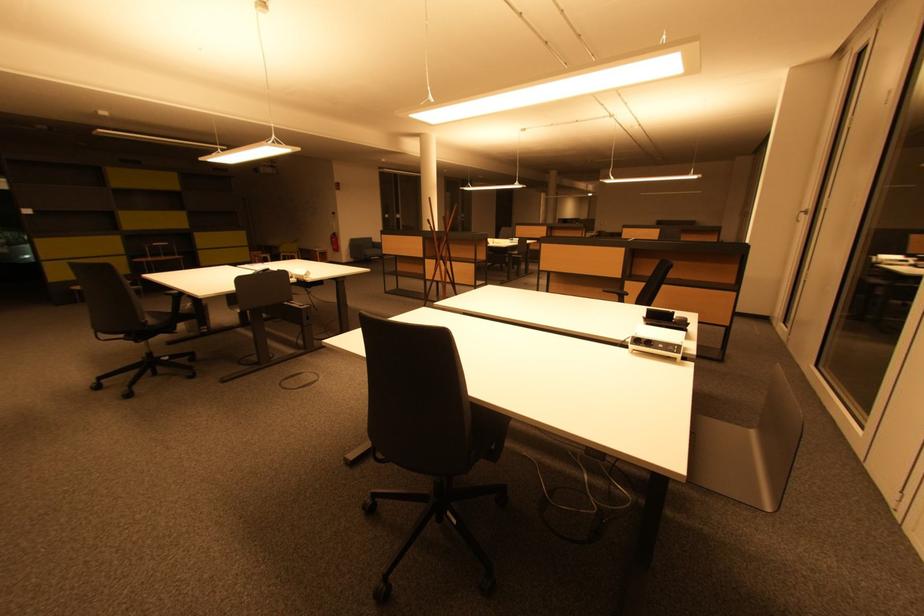
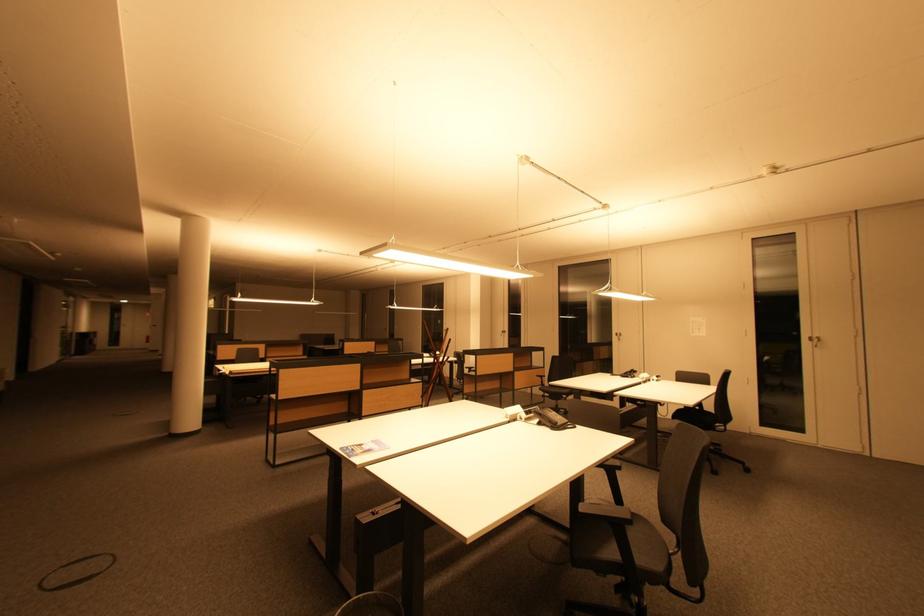
Question: I am providing you with two images of the same scene from different viewpoints. Which of the following objects are not visible in image2?

Choices:
 (A) phone handset
 (B) silver door handle
 (C) black power adapter
 (D) black telephone handset

Answer: (A)